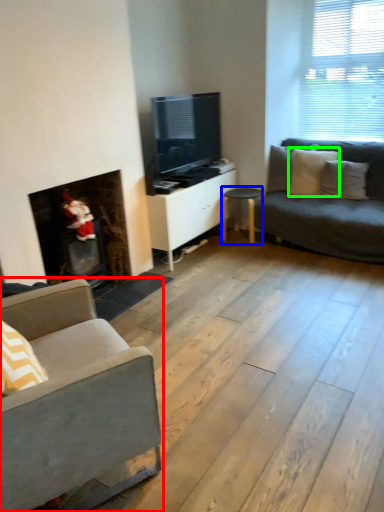
Question: Considering the real-world distances, which object is farthest from studio couch (highlighted by a red box)? table (highlighted by a blue box) or pillow (highlighted by a green box)?

Choices:
 (A) table
 (B) pillow

Answer: (B)